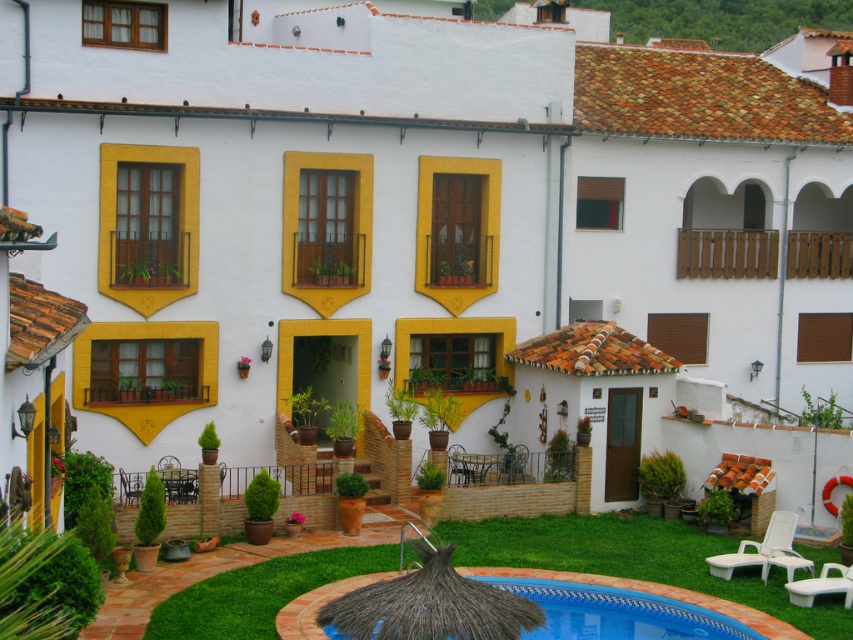
Can you confirm if green grass at lower center is positioned below blue tile swimming pool at lower center?

No, green grass at lower center is not below blue tile swimming pool at lower center.

Does point (155, 611) come behind point (701, 627)?

No.

Between point (184, 632) and point (587, 628), which one is positioned in front?

Positioned in front is point (184, 632).

Locate an element on the screen. Image resolution: width=853 pixels, height=640 pixels. green grass at lower center is located at coordinates (636, 560).